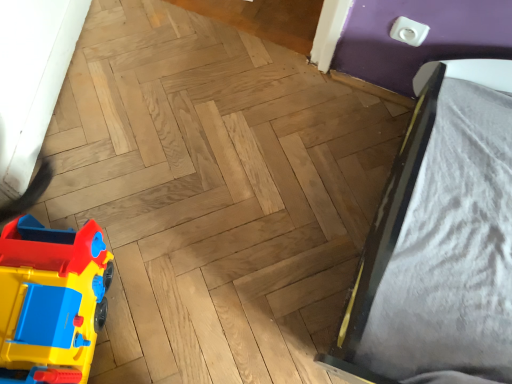
Measure the distance between point (19, 336) and camera.

Point (19, 336) is 31.30 inches from camera.

Based on the photo, in order to face matte plastic toy car at lower left, should I rotate leftwards or rightwards?

Turn left approximately 25.191 degrees to face it.

What do you see at coordinates (51, 301) in the screenshot? I see `matte plastic toy car at lower left` at bounding box center [51, 301].

Find the location of a particular element. Image resolution: width=512 pixels, height=384 pixels. matte plastic toy car at lower left is located at coordinates (51, 301).

Image resolution: width=512 pixels, height=384 pixels. What are the coordinates of `matte plastic toy car at lower left` in the screenshot? It's located at (51, 301).